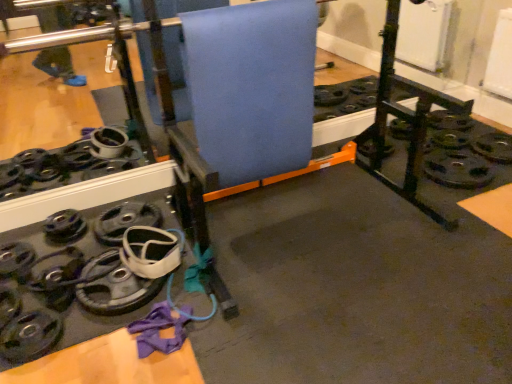
Question: Is blue fabric yoga mat at center to the left or to the right of black rubber weight at lower left in the image?

Choices:
 (A) right
 (B) left

Answer: (A)

Question: Is blue fabric yoga mat at center wider or thinner than black rubber weight at lower left?

Choices:
 (A) thin
 (B) wide

Answer: (A)

Question: Is blue fabric yoga mat at center situated inside black rubber weight at lower left or outside?

Choices:
 (A) inside
 (B) outside

Answer: (B)

Question: From a real-world perspective, is black rubber weight at lower left positioned above or below blue fabric yoga mat at center?

Choices:
 (A) above
 (B) below

Answer: (B)

Question: Is point (26, 326) closer or farther from the camera than point (246, 152)?

Choices:
 (A) closer
 (B) farther

Answer: (A)

Question: Relative to blue fabric yoga mat at center, is black rubber weight at lower left in front or behind?

Choices:
 (A) behind
 (B) front

Answer: (B)

Question: In terms of height, does black rubber weight at lower left look taller or shorter compared to blue fabric yoga mat at center?

Choices:
 (A) short
 (B) tall

Answer: (A)